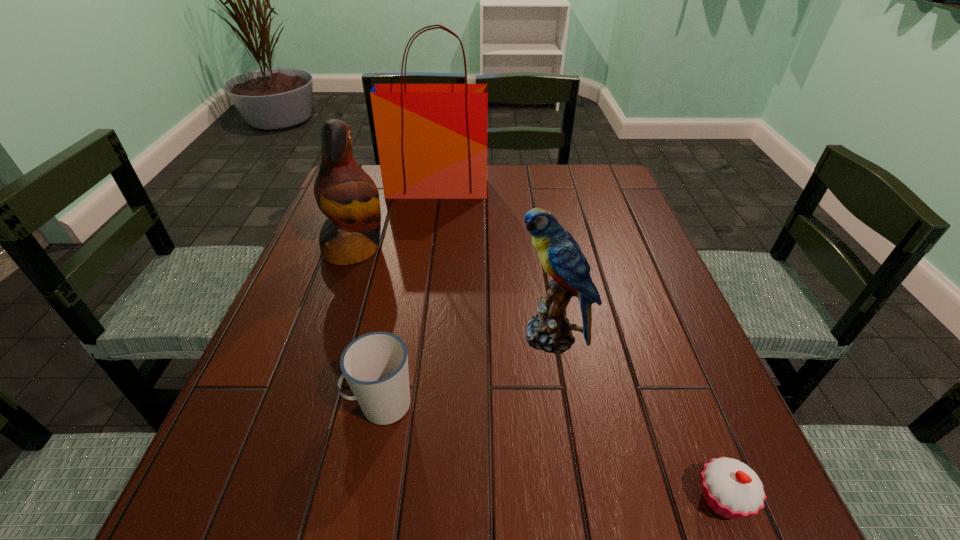
Image resolution: width=960 pixels, height=540 pixels. In order to click on vacant space that is in between the cup and the left parrot in this screenshot , I will do `click(368, 327)`.

Where is `free space between the shopping bag and the cup`? The width and height of the screenshot is (960, 540). free space between the shopping bag and the cup is located at coordinates (409, 296).

Image resolution: width=960 pixels, height=540 pixels. I want to click on vacant area that lies between the cup and the left parrot, so click(368, 327).

I want to click on free area in between the farthest object and the second nearest object, so click(409, 296).

Locate an element on the screen. Image resolution: width=960 pixels, height=540 pixels. free space between the fourth tallest object and the shorter parrot is located at coordinates (466, 370).

I want to click on free space between the tallest object and the third tallest object, so click(x=494, y=262).

Where is `free point between the shopping bag and the cupcake`? free point between the shopping bag and the cupcake is located at coordinates (580, 343).

Find the location of a particular element. free space between the second farthest object and the rightmost object is located at coordinates (539, 374).

What are the coordinates of `vacant area between the farther parrot and the second shortest object` in the screenshot? It's located at (368, 327).

Select which object appears as the fourth closest to the second shortest object. Please provide its 2D coordinates. Your answer should be formatted as a tuple, i.e. [(x, y)], where the tuple contains the x and y coordinates of a point satisfying the conditions above.

[(432, 138)]